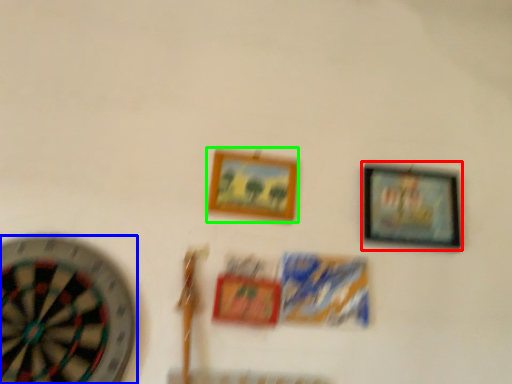
Question: Which object is the farthest from picture frame (highlighted by a red box)? Choose among these: wheel (highlighted by a blue box) or picture frame (highlighted by a green box).

Choices:
 (A) wheel
 (B) picture frame

Answer: (A)